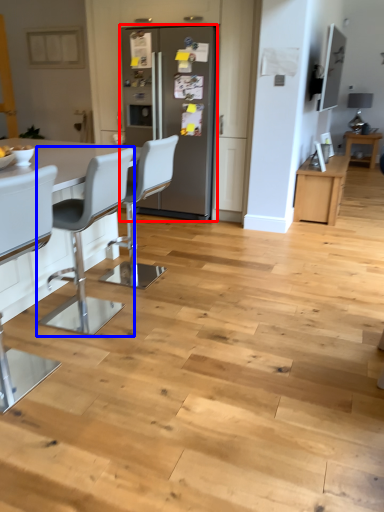
Question: Which of the following is the farthest to the observer, fridge (highlighted by a red box) or chair (highlighted by a blue box)?

Choices:
 (A) fridge
 (B) chair

Answer: (A)